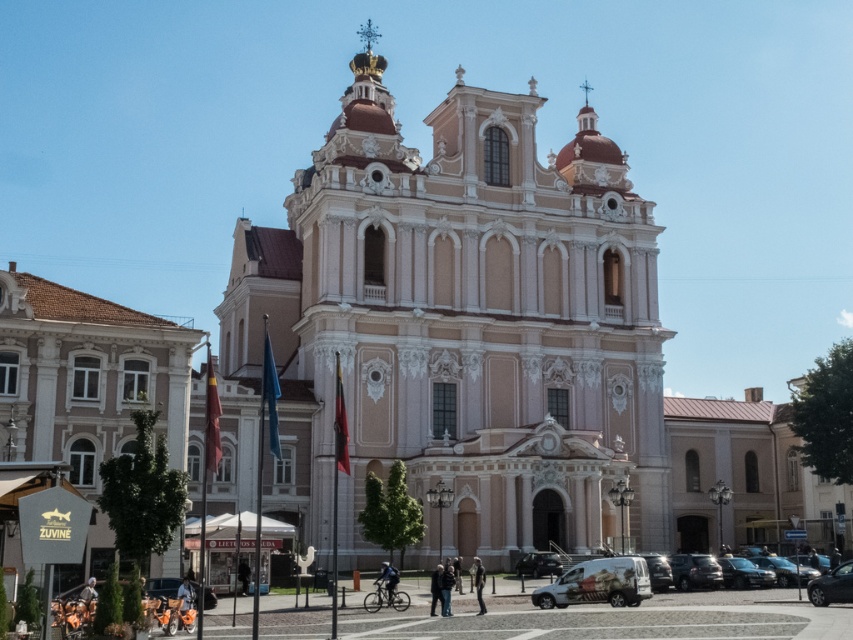
Question: From the image, what is the correct spatial relationship of white matte van at lower center in relation to shiny black car at lower right?

Choices:
 (A) left
 (B) right

Answer: (A)

Question: Which point appears closest to the camera in this image?

Choices:
 (A) (688, 577)
 (B) (691, 577)
 (C) (810, 600)
 (D) (532, 596)

Answer: (D)

Question: Considering the real-world distances, which object is closest to the metallic silver car at lower right?

Choices:
 (A) metallic silver van at lower center
 (B) shiny black car at lower right

Answer: (A)

Question: Which object is farther from the camera taking this photo?

Choices:
 (A) metallic silver car at lower right
 (B) black glossy car at lower right

Answer: (B)

Question: Does shiny black car at lower right lie in front of black glossy car at lower right?

Choices:
 (A) yes
 (B) no

Answer: (A)

Question: Is white matte van at lower center closer to the viewer compared to shiny black car at lower right?

Choices:
 (A) no
 (B) yes

Answer: (A)